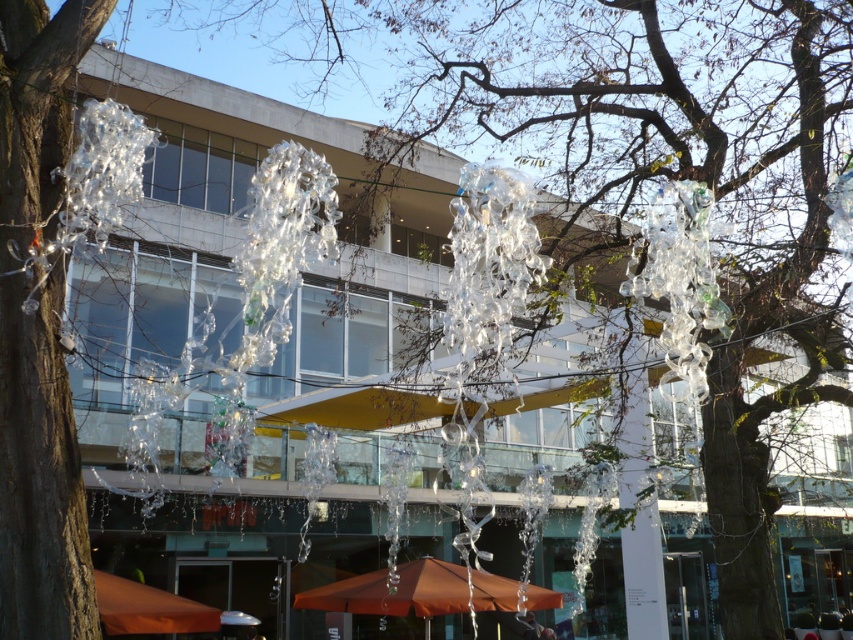
Question: Does orange fabric umbrella at center lie in front of orange fabric umbrella at lower left?

Choices:
 (A) yes
 (B) no

Answer: (B)

Question: Does orange fabric umbrella at center appear on the left side of orange fabric umbrella at lower left?

Choices:
 (A) yes
 (B) no

Answer: (B)

Question: Which point is farther to the camera?

Choices:
 (A) orange fabric umbrella at lower left
 (B) orange fabric umbrella at center

Answer: (B)

Question: Can you confirm if orange fabric umbrella at center is smaller than orange fabric umbrella at lower left?

Choices:
 (A) no
 (B) yes

Answer: (A)